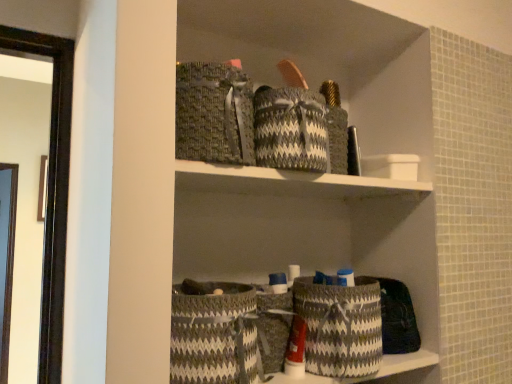
Question: Is point (368, 374) closer or farther from the camera than point (264, 294)?

Choices:
 (A) closer
 (B) farther

Answer: (A)

Question: Choose the correct answer: Is gray woven basket at lower center, the 1th basket in the right-to-left sequence, inside gray woven basket at center, placed as the 2th basket when sorted from right to left, or outside it?

Choices:
 (A) inside
 (B) outside

Answer: (B)

Question: Which of these objects is positioned closest to the gray woven basket at center, placed as the 2th basket when sorted from right to left?

Choices:
 (A) gray woven basket at lower center, placed as the first basket when sorted from left to right
 (B) gray woven basket at lower center, which is the third basket from left to right

Answer: (A)

Question: Estimate the real-world distances between objects in this image. Which object is closer to the gray woven basket at lower center, the 1th basket in the right-to-left sequence?

Choices:
 (A) gray woven basket at lower center, which is the 3th basket in right-to-left order
 (B) gray woven basket at center, placed as the 2th basket when sorted from right to left

Answer: (B)